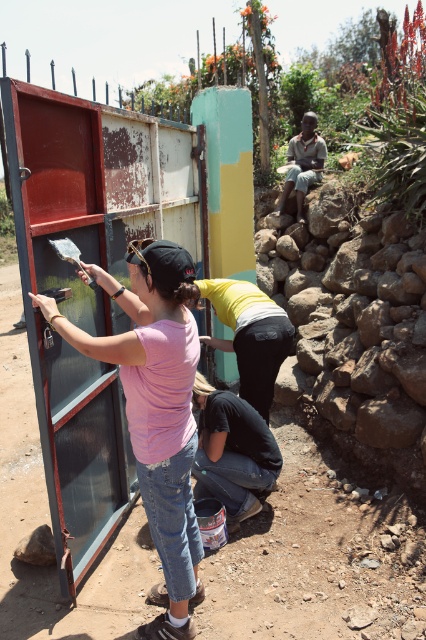
You are observing two workers at a construction site. You notice the pink matte shirt at center and the denim jeans at lower center. Which clothing item is positioned higher in the image?

The pink matte shirt at center is taller than the denim jeans at lower center, so the pink matte shirt at center is positioned higher in the image.

You are a photographer trying to capture a clear shot of the pink matte shirt at center and the light brown wooden chair at upper center. Which object should you focus on first to ensure both are in frame?

The pink matte shirt at center is below the light brown wooden chair at upper center, so you should focus on the light brown wooden chair at upper center first to ensure both are in frame.